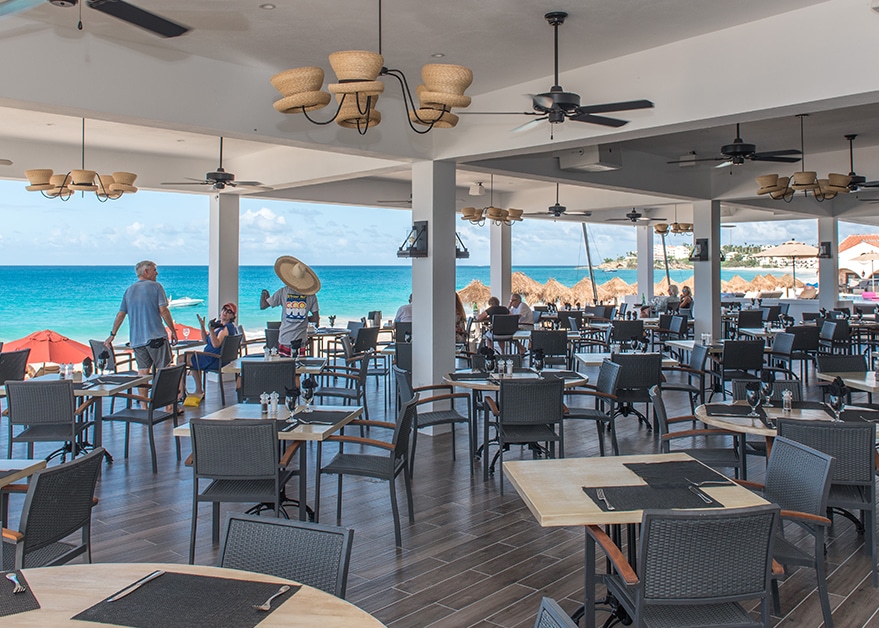
You are a GUI agent. You are given a task and a screenshot of the screen. Output one action in this format:
    pyautogui.click(x=<x>, y=<y>)
    Task: Click on the chair
    
    Given the screenshot: What is the action you would take?
    pyautogui.click(x=608, y=380)